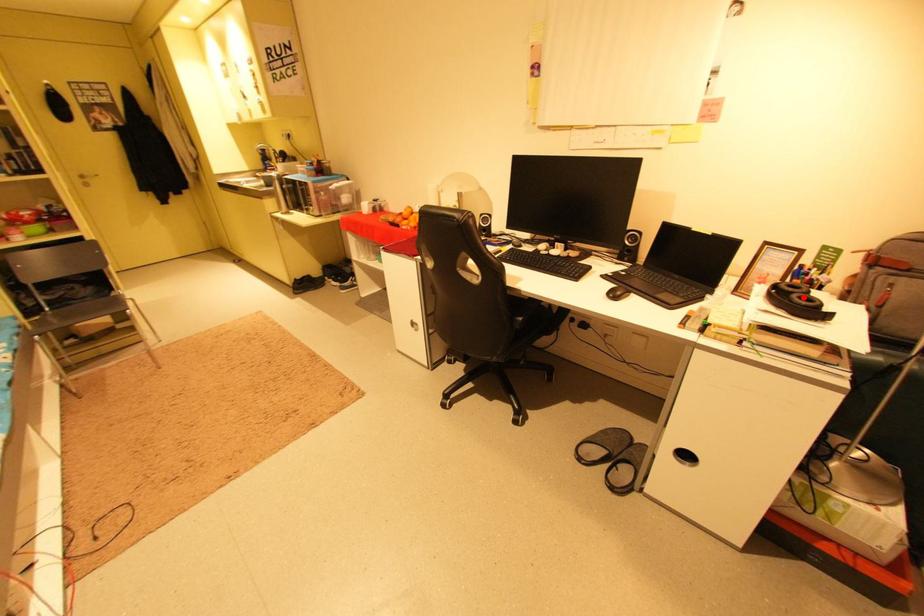
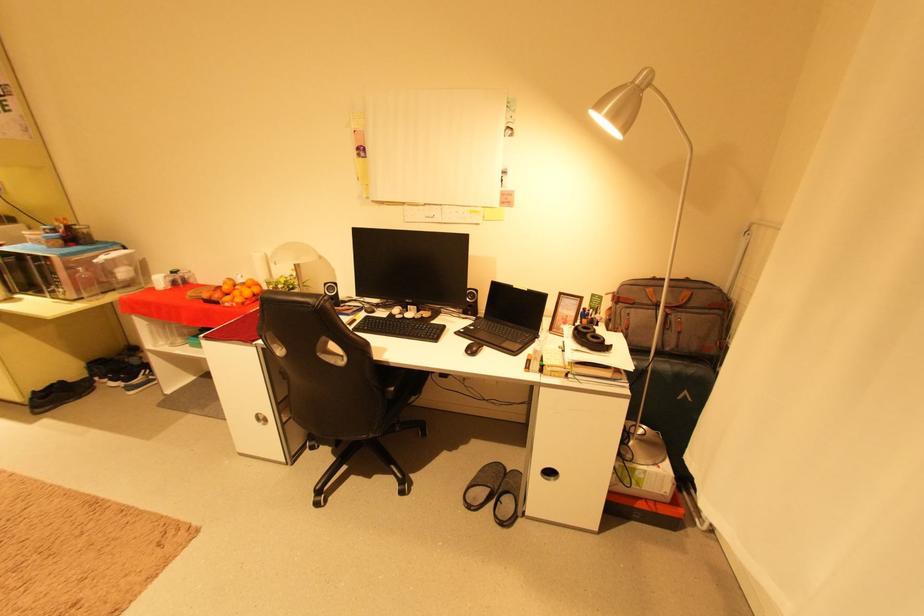
Locate, in the second image, the point that corresponds to the highlighted location in the first image.

(596, 336)